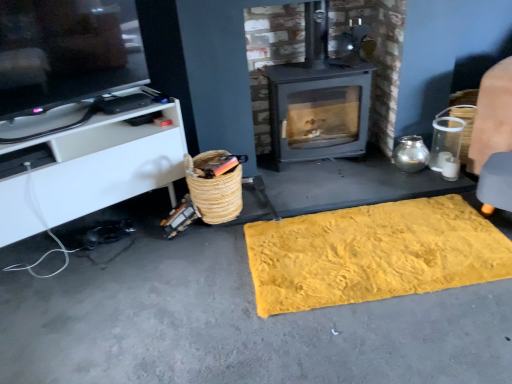
Locate an element on the screen. vacant region in front of woven straw basket at lower left is located at coordinates (206, 254).